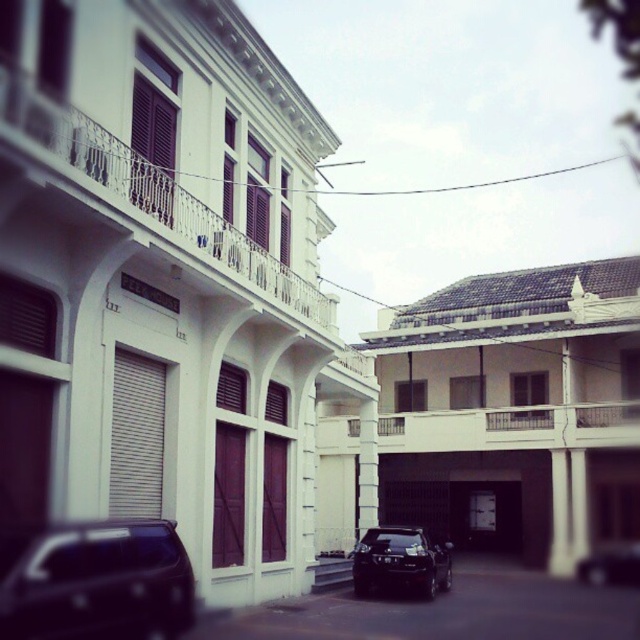
You are a delivery person needing to park your vehicle between the dark matte car at lower left and the shiny black suv at center. Given that your delivery van is 2 meters wide, can you fit it in the space between them?

The dark matte car at lower left is thinner than the shiny black suv at center. The space between them is determined by the width of the two vehicles. Since the suv is wider, the space between them may be sufficient for a 2m van, but without exact measurements, it is uncertain. However, based on the description, the suv is wider, so the space between them might be enough. However, the answer should strictly use the given info. Since the car is thinner than the SUV, the space between them is wider than the 2

From the picture: You are standing at the center of the street and see the point marked at coordinates (97, 580). What object is located at that point?

The dark matte car at lower left is located at point (97, 580).

You are standing at the center of the image. Which direction should you walk to reach the dark matte car at lower left?

You should walk to the lower left direction to reach the dark matte car at lower left.